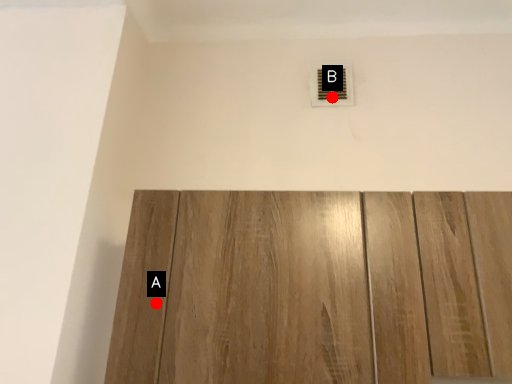
Question: Two points are circled on the image, labeled by A and B beside each circle. Which point is closer to the camera taking this photo?

Choices:
 (A) A is closer
 (B) B is closer

Answer: (A)